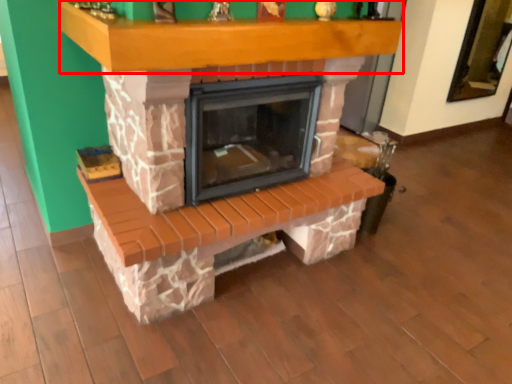
Question: From the image's perspective, where is mantle (annotated by the red box) located relative to fireplace?

Choices:
 (A) below
 (B) above

Answer: (B)